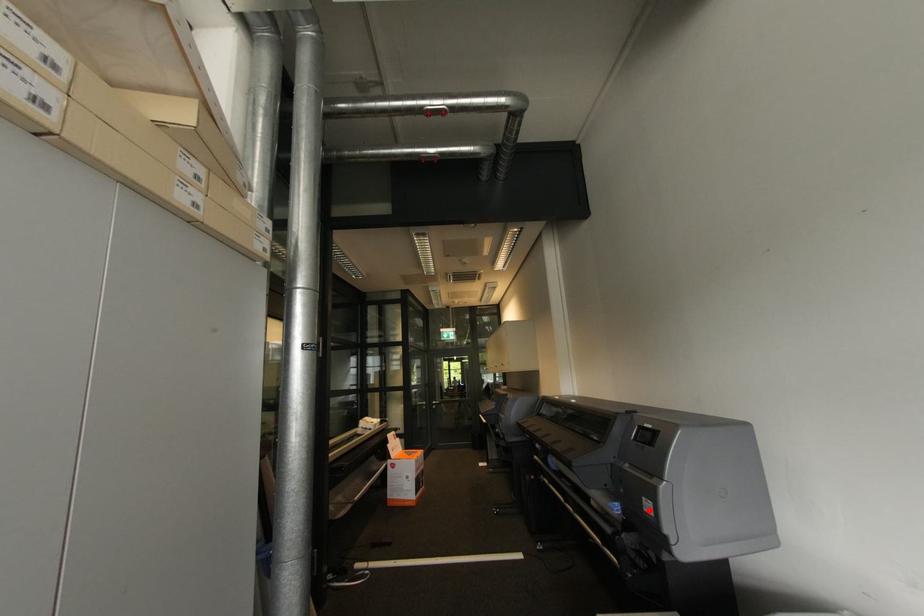
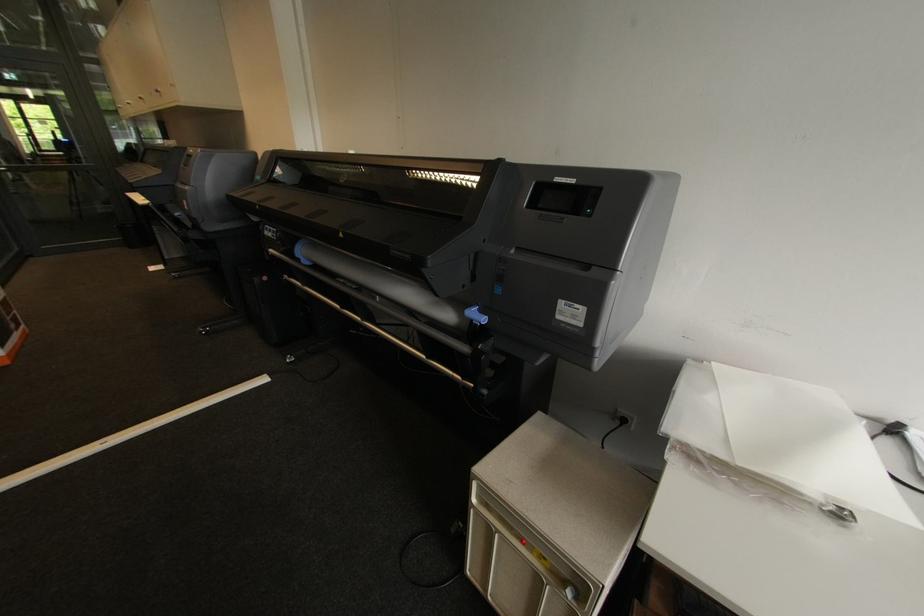
In the second image, find the point that corresponds to the highlighted location in the first image.

(563, 318)